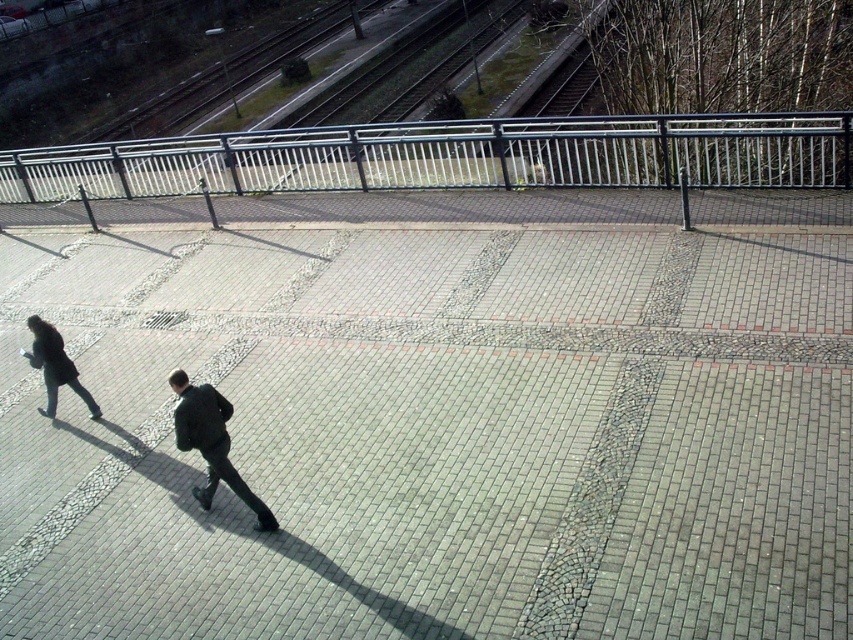
You are a delivery person carrying a large package that is 1.5 meters wide. You need to walk across the gray brick pavement at center and the dark gray coat at lower left. Which object can accommodate your package without it spilling over?

The gray brick pavement at center is larger in size than the dark gray coat at lower left, so the package can be placed on the gray brick pavement at center without spilling over.